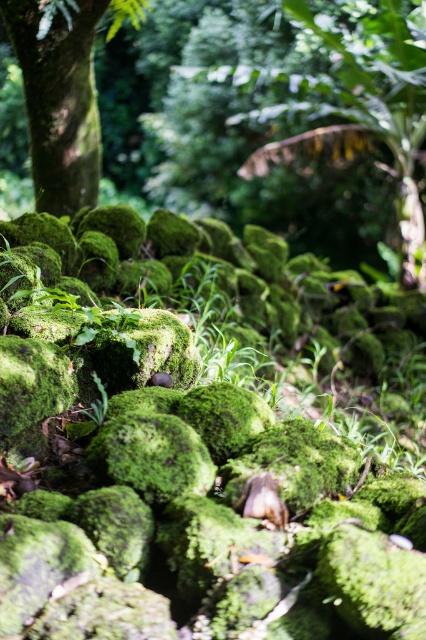
Looking at this image, you are a hiker trying to cross a mossy area. You see a green mossy rock at center and a green mossy tree trunk at left. Which one has a larger width?

The green mossy rock at center might be wider than green mossy tree trunk at left.

You are standing at the center of the image and want to place a small decorative statue on the green mossy rock at center. If the statue requires a flat surface of at least 0.2 square meters to be placed securely, can the rock accommodate it based on its position?

The green mossy rock at center is located at point (350, 100), but the provided information does not specify the size or surface area of the rock. Therefore, it is unclear if the statue can be placed securely here.

You are a hiker trying to navigate through the mossy rocks. You see the green mossy rock at center and the green mossy tree trunk at left. Which one is taller?

The green mossy rock at center is much taller than the green mossy tree trunk at left.